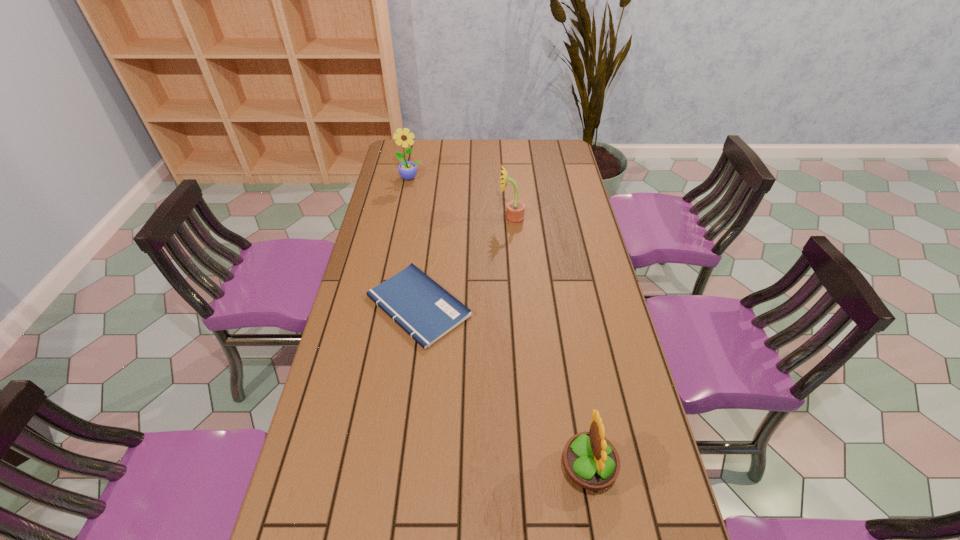
At what (x,y) coordinates should I click in order to perform the action: click on vacant point located between the leftmost sunflower and the nearest sunflower. Please return your answer as a coordinate pair (x, y). The width and height of the screenshot is (960, 540). Looking at the image, I should click on (499, 323).

Locate an element on the screen. Image resolution: width=960 pixels, height=540 pixels. free spot between the second farthest sunflower and the shortest object is located at coordinates (465, 262).

Locate an element on the screen. free space between the leftmost sunflower and the shortest sunflower is located at coordinates (499, 323).

At what (x,y) coordinates should I click in order to perform the action: click on free space between the shortest object and the second object from right to left. Please return your answer as a coordinate pair (x, y). Looking at the image, I should click on (465, 262).

This screenshot has height=540, width=960. I want to click on the third closest object relative to the rightmost object, so pyautogui.click(x=407, y=169).

Select which object is the second closest to the farthest sunflower. Please provide its 2D coordinates. Your answer should be formatted as a tuple, i.e. [(x, y)], where the tuple contains the x and y coordinates of a point satisfying the conditions above.

[(426, 311)]

Identify which sunflower is the nearest to the second sunflower from right to left. Please provide its 2D coordinates. Your answer should be formatted as a tuple, i.e. [(x, y)], where the tuple contains the x and y coordinates of a point satisfying the conditions above.

[(407, 169)]

Find the location of a particular element. Image resolution: width=960 pixels, height=540 pixels. sunflower that is the closest one to the second object from right to left is located at coordinates (407, 169).

The width and height of the screenshot is (960, 540). I want to click on free location that satisfies the following two spatial constraints: 1. on the front-facing side of the second nearest object; 2. on the left side of the leftmost sunflower, so click(x=385, y=306).

Find the location of `free space that satisfies the following two spatial constraints: 1. on the front-facing side of the farthest sunflower; 2. on the right side of the third farthest object`. free space that satisfies the following two spatial constraints: 1. on the front-facing side of the farthest sunflower; 2. on the right side of the third farthest object is located at coordinates (385, 306).